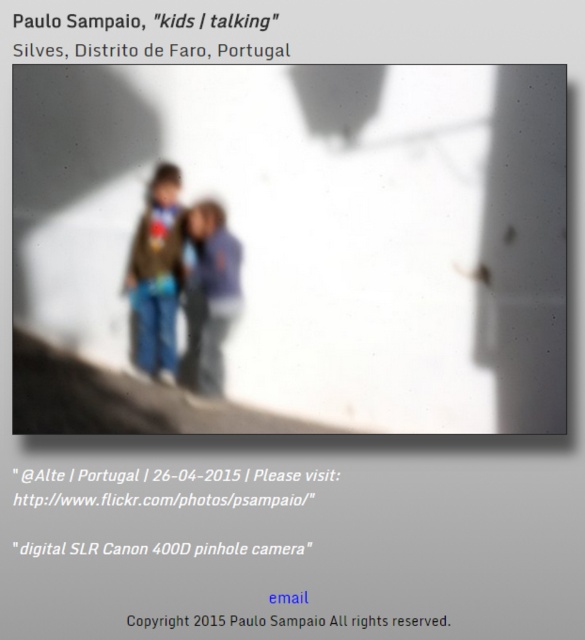
You are a photographer analyzing the composition of the image. The photo has a point of interest at point (180, 284). What object in the image corresponds to this coordinate?

The point at (180, 284) corresponds to the matte brown jacket at center.

You are a photographer who wants to ensure that both the matte brown jacket at center and the matte blue jeans at center are clearly visible in the photo. Since the jacket is wider, which part of the two should you adjust the focus on to make sure both are sharp?

The matte brown jacket at center is wider than the matte blue jeans at center, so you should adjust the focus on the matte brown jacket at center to ensure both are sharp.